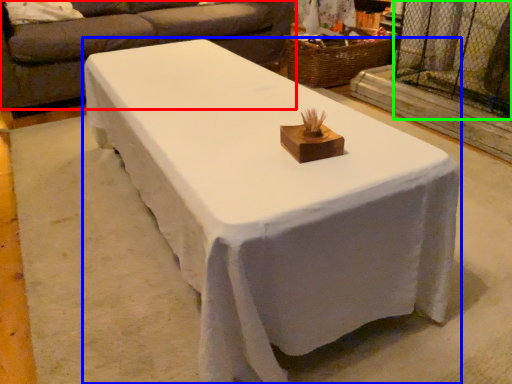
Question: Based on their relative distances, which object is farther from studio couch (highlighted by a red box)? Choose from table (highlighted by a blue box) and screen door (highlighted by a green box).

Choices:
 (A) table
 (B) screen door

Answer: (A)